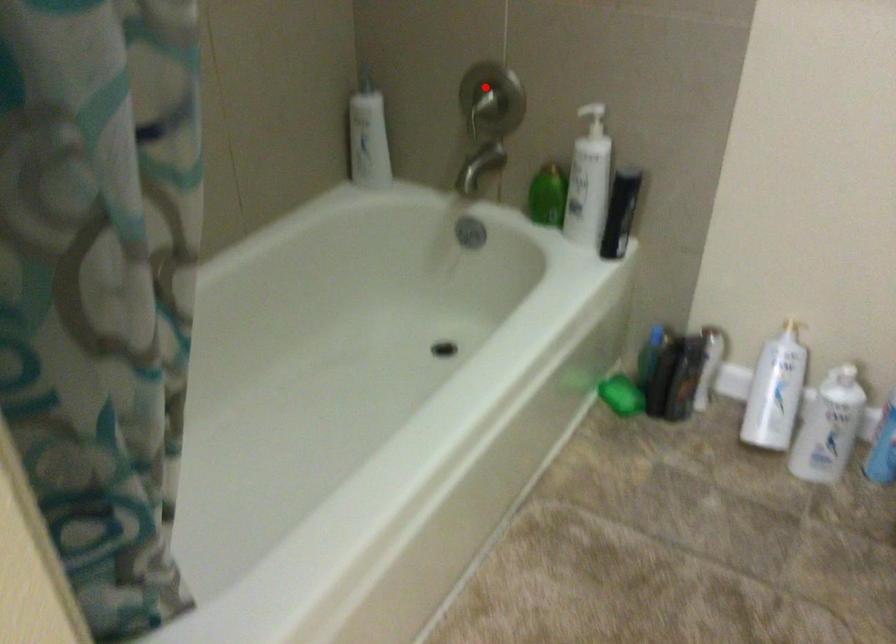
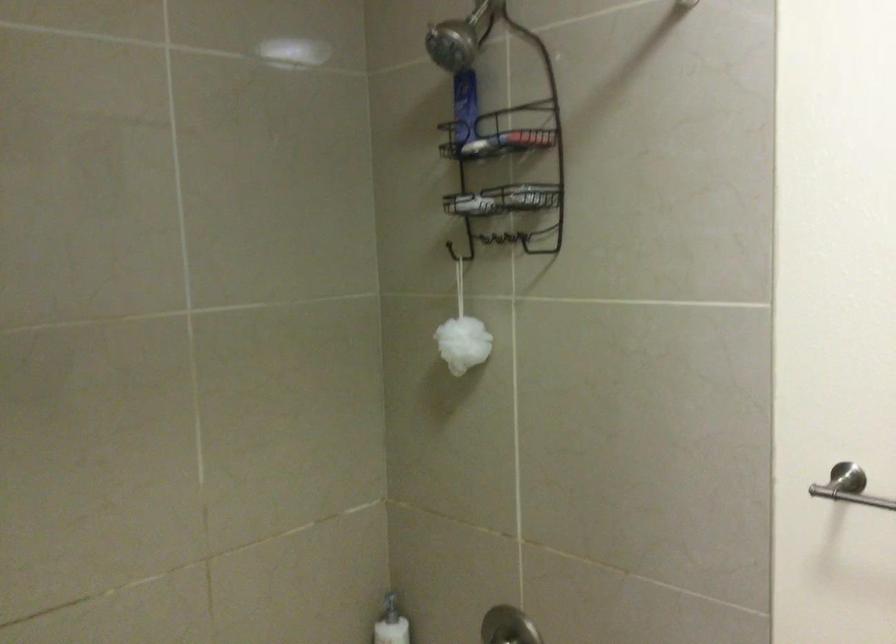
Locate, in the second image, the point that corresponds to the highlighted location in the first image.

(506, 627)